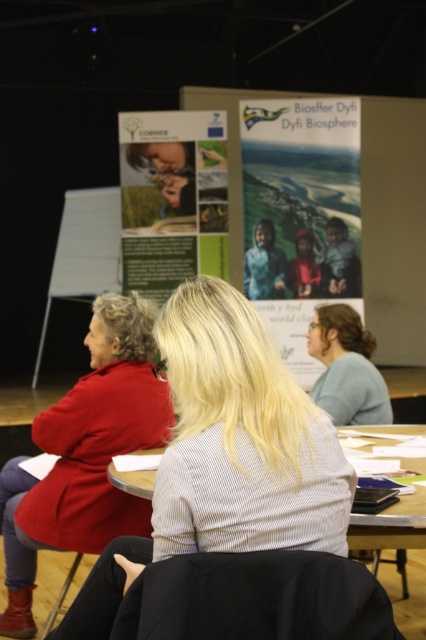
Question: Can you confirm if matte red coat at left is positioned to the right of light blue fabric shirt at center?

Choices:
 (A) yes
 (B) no

Answer: (B)

Question: Which object is farther from the camera taking this photo?

Choices:
 (A) light blue fabric shirt at center
 (B) matte red coat at left
 (C) wooden table at center
 (D) matte paper poster at center

Answer: (D)

Question: Which object appears closest to the camera in this image?

Choices:
 (A) green paper poster at center
 (B) light blue fabric shirt at center
 (C) matte paper poster at center
 (D) matte red coat at left

Answer: (D)

Question: Which object appears farthest from the camera in this image?

Choices:
 (A) wooden table at center
 (B) matte paper poster at center

Answer: (B)

Question: Can you confirm if matte paper poster at center is thinner than light blue fabric shirt at center?

Choices:
 (A) no
 (B) yes

Answer: (A)

Question: Is green paper poster at center positioned behind wooden table at center?

Choices:
 (A) yes
 (B) no

Answer: (A)